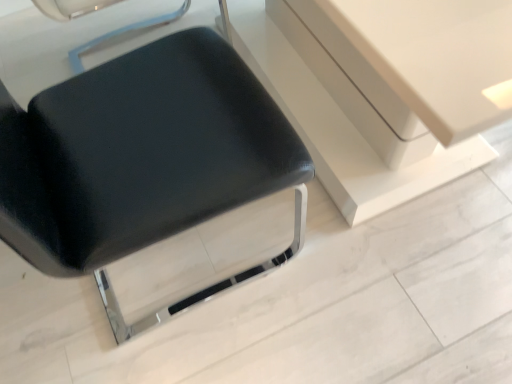
The width and height of the screenshot is (512, 384). What are the coordinates of `vacant space underneath black leather chair at center (from a real-world perspective)` in the screenshot? It's located at (207, 258).